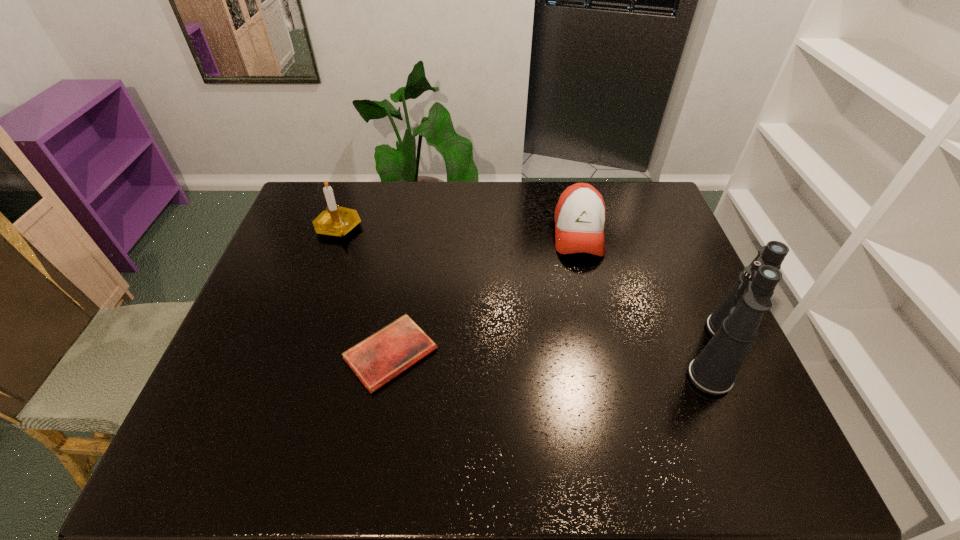
The image size is (960, 540). I want to click on object that is the third closest to the second object from left to right, so click(x=733, y=326).

You are a GUI agent. You are given a task and a screenshot of the screen. Output one action in this format:
    pyautogui.click(x=<x>, y=<y>)
    Task: Click on the vacant space that satisfies the following two spatial constraints: 1. on the back side of the binoculars; 2. on the right side of the diary
    The height and width of the screenshot is (540, 960).
    Given the screenshot: What is the action you would take?
    pyautogui.click(x=391, y=353)

Identify the location of free space that satisfies the following two spatial constraints: 1. on the back side of the third tallest object; 2. on the left side of the third object from right to left. (411, 233).

Image resolution: width=960 pixels, height=540 pixels. I want to click on vacant area in the image that satisfies the following two spatial constraints: 1. on the front side of the second object from left to right; 2. on the left side of the second tallest object, so click(294, 354).